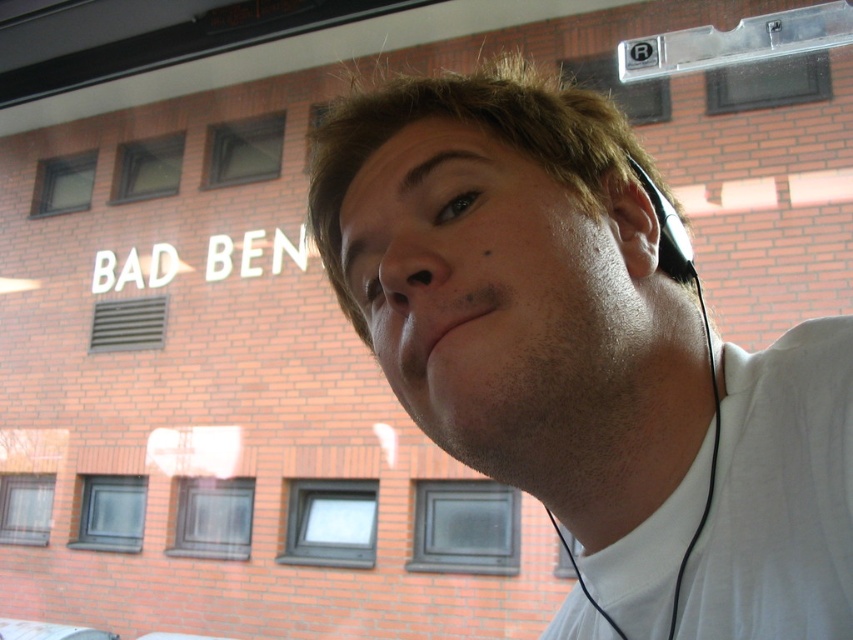
Question: Is white matte headphones at upper center closer to the viewer compared to clear glass window at upper left?

Choices:
 (A) no
 (B) yes

Answer: (B)

Question: Which is nearer to the matte gray window at center?

Choices:
 (A) white matte shirt at lower right
 (B) transparent glass window at lower left

Answer: (B)

Question: Among these objects, which one is nearest to the camera?

Choices:
 (A) clear glass window at upper center
 (B) transparent glass window at upper left
 (C) clear glass window at upper left
 (D) dark gray glass window at lower left

Answer: (D)

Question: Does black glass window at center appear over clear glass window at upper center?

Choices:
 (A) yes
 (B) no

Answer: (B)

Question: Considering the relative positions of matte gray window at center and transparent plastic window at upper center in the image provided, where is matte gray window at center located with respect to transparent plastic window at upper center?

Choices:
 (A) right
 (B) left

Answer: (B)

Question: Which point is farther from the camera taking this photo?

Choices:
 (A) (96, 154)
 (B) (827, 547)
 (C) (251, 508)
 (D) (595, 61)

Answer: (A)